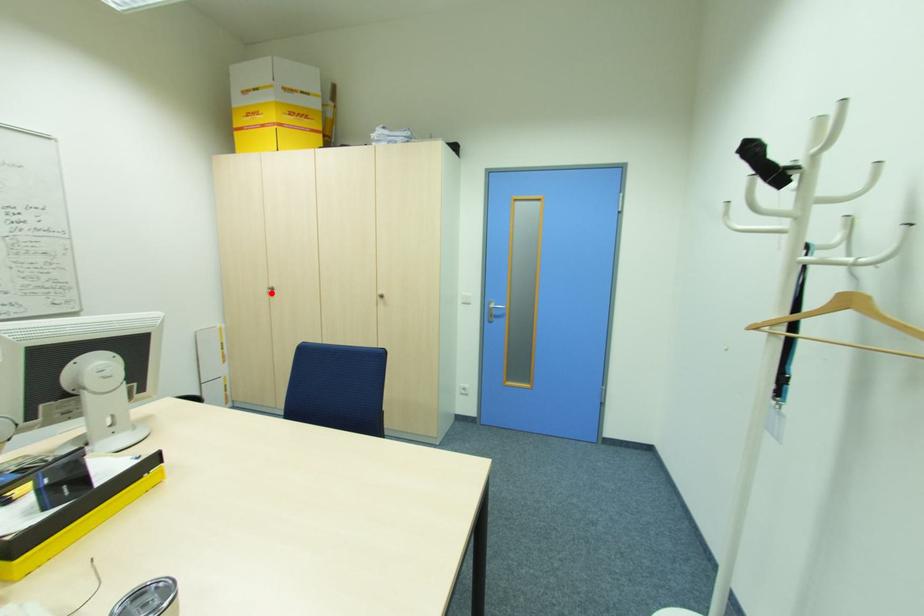
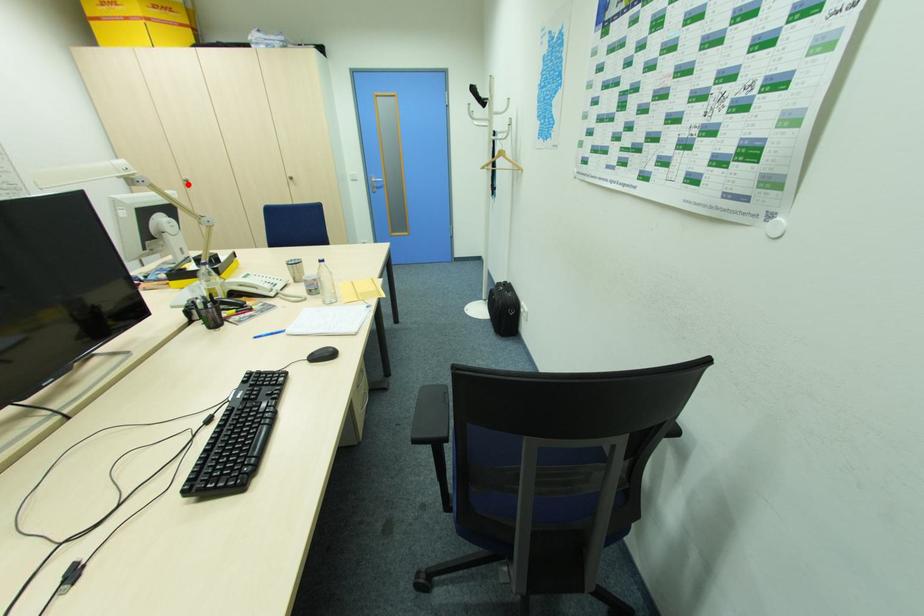
I am providing you with two images of the same scene from different viewpoints. A red point is marked on the first image and another point is marked on the second image. Is the marked point in image1 the same physical position as the marked point in image2?

Yes